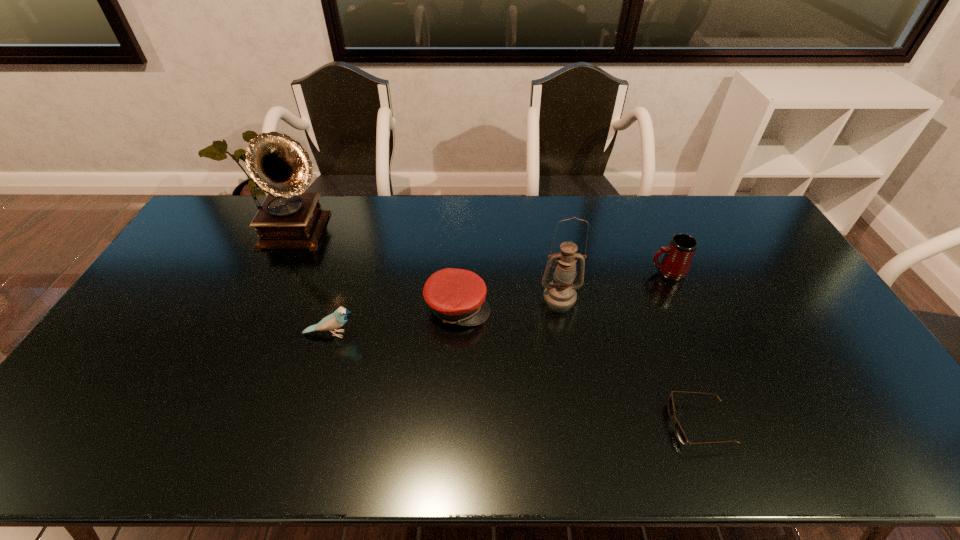
You are a GUI agent. You are given a task and a screenshot of the screen. Output one action in this format:
    pyautogui.click(x=<x>, y=<y>)
    Task: Click on the free point between the nearest object and the fifth object from right to left
    This screenshot has height=540, width=960.
    Given the screenshot: What is the action you would take?
    pyautogui.click(x=516, y=379)

Locate an element on the screen. Image resolution: width=960 pixels, height=540 pixels. vacant area that lies between the shortest object and the mug is located at coordinates (684, 348).

This screenshot has height=540, width=960. In order to click on free space between the cap and the bird in this screenshot , I will do `click(395, 320)`.

The height and width of the screenshot is (540, 960). Find the location of `free space between the leftmost object and the fifth tallest object`. free space between the leftmost object and the fifth tallest object is located at coordinates (378, 271).

I want to click on vacant area that lies between the sunglasses and the cap, so click(x=579, y=366).

Locate an element on the screen. Image resolution: width=960 pixels, height=540 pixels. unoccupied area between the second shortest object and the tallest object is located at coordinates (378, 271).

Identify the location of the fourth closest object to the mug. (337, 319).

Select which object is the fifth closest to the cap. Please provide its 2D coordinates. Your answer should be formatted as a tuple, i.e. [(x, y)], where the tuple contains the x and y coordinates of a point satisfying the conditions above.

[(675, 264)]

Where is `vacant area that satisfies the following two spatial constraints: 1. on the horn of the oil lamp; 2. on the right side of the leftmost object`? This screenshot has width=960, height=540. vacant area that satisfies the following two spatial constraints: 1. on the horn of the oil lamp; 2. on the right side of the leftmost object is located at coordinates (270, 295).